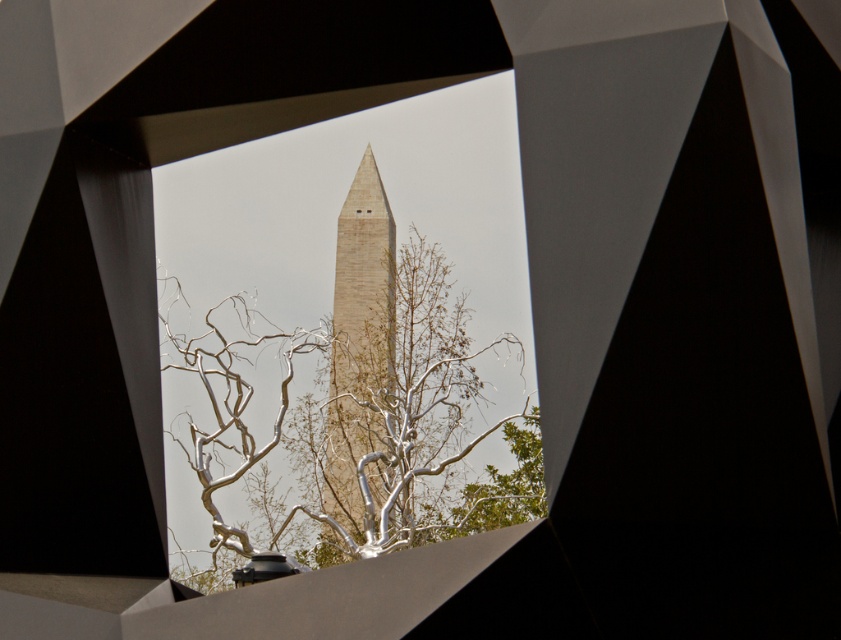
Question: Does silver metallic branches at center appear under beige stone obelisk at center?

Choices:
 (A) no
 (B) yes

Answer: (B)

Question: Which of the following is the closest to the observer?

Choices:
 (A) [x=352, y=470]
 (B) [x=215, y=456]

Answer: (B)

Question: Can you confirm if silver metallic branches at center is thinner than beige stone obelisk at center?

Choices:
 (A) yes
 (B) no

Answer: (B)

Question: Which point appears closest to the camera in this image?

Choices:
 (A) (356, 456)
 (B) (416, 304)

Answer: (A)

Question: Among these objects, which one is farthest from the camera?

Choices:
 (A) silver metallic branches at center
 (B) beige stone obelisk at center

Answer: (B)

Question: Can you confirm if silver metallic branches at center is positioned to the left of beige stone obelisk at center?

Choices:
 (A) yes
 (B) no

Answer: (A)